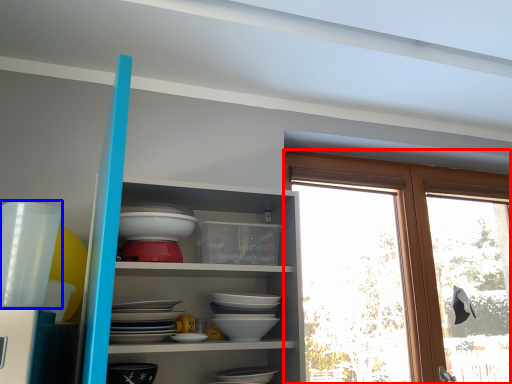
Question: Among these objects, which one is nearest to the camera, window (highlighted by a red box) or tableware (highlighted by a blue box)?

Choices:
 (A) window
 (B) tableware

Answer: (B)